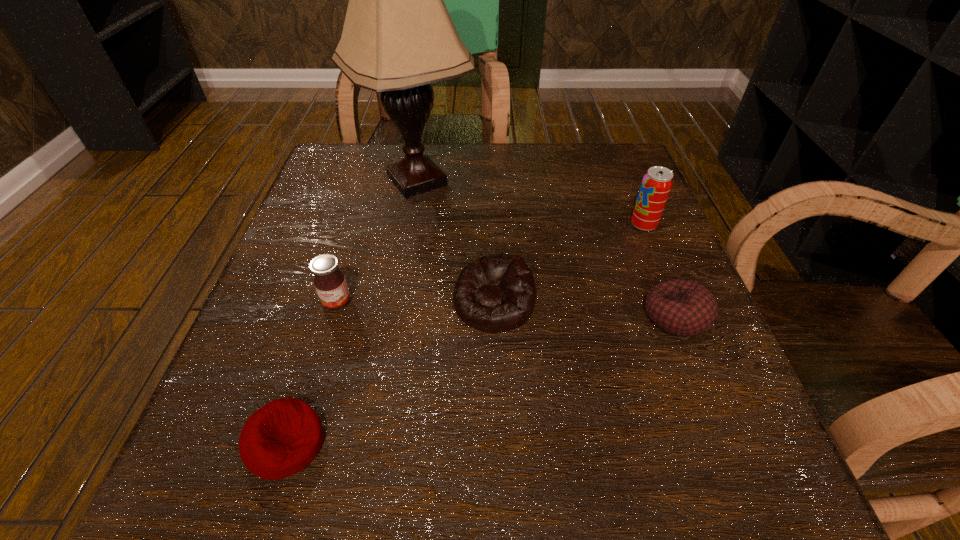
This screenshot has height=540, width=960. In order to click on empty space between the soda can and the nearest object in this screenshot , I will do `click(465, 334)`.

Locate an element on the screen. This screenshot has height=540, width=960. free space between the soda can and the rightmost beanbag is located at coordinates (660, 271).

Identify the location of free space that is in between the second tallest object and the rightmost beanbag. (660, 271).

This screenshot has width=960, height=540. Find the location of `vacant area between the lamp and the third tallest object`. vacant area between the lamp and the third tallest object is located at coordinates tap(377, 241).

In order to click on free space between the tallest object and the rightmost beanbag in this screenshot , I will do `click(546, 248)`.

At what (x,y) coordinates should I click in order to perform the action: click on vacant space in between the rightmost beanbag and the nearest object. Please return your answer as a coordinate pair (x, y). Looking at the image, I should click on (481, 380).

Image resolution: width=960 pixels, height=540 pixels. I want to click on vacant region between the tallest object and the rightmost beanbag, so click(x=546, y=248).

Where is `the closest object to the fourth shortest object`? the closest object to the fourth shortest object is located at coordinates (281, 438).

The image size is (960, 540). I want to click on object that can be found as the closest to the rightmost beanbag, so click(656, 185).

In order to click on the closest beanbag to the lamp in this screenshot , I will do `click(496, 293)`.